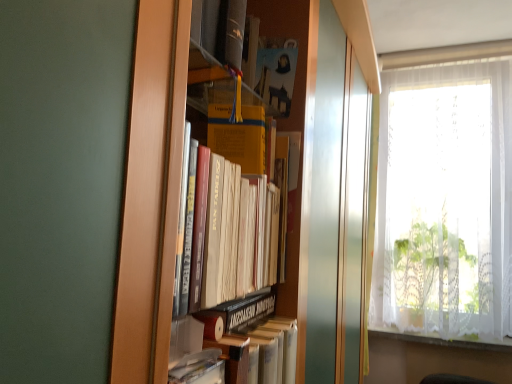
Question: Does hardcover book at center have a larger size compared to white lace curtain at right?

Choices:
 (A) yes
 (B) no

Answer: (B)

Question: Is hardcover book at center to the left of white lace curtain at right from the viewer's perspective?

Choices:
 (A) yes
 (B) no

Answer: (A)

Question: From a real-world perspective, is hardcover book at center located beneath white lace curtain at right?

Choices:
 (A) no
 (B) yes

Answer: (B)

Question: Does hardcover book at center have a lesser height compared to white lace curtain at right?

Choices:
 (A) yes
 (B) no

Answer: (A)

Question: Are hardcover book at center and white lace curtain at right making contact?

Choices:
 (A) no
 (B) yes

Answer: (A)

Question: Is hardcover book at center aimed at white lace curtain at right?

Choices:
 (A) yes
 (B) no

Answer: (B)

Question: Is hardcover book at center at the right side of white lace curtain at lower right?

Choices:
 (A) no
 (B) yes

Answer: (A)

Question: Does hardcover book at center have a greater width compared to white lace curtain at lower right?

Choices:
 (A) no
 (B) yes

Answer: (A)

Question: Is hardcover book at center at the left side of white lace curtain at lower right?

Choices:
 (A) yes
 (B) no

Answer: (A)

Question: From a real-world perspective, is hardcover book at center physically below white lace curtain at lower right?

Choices:
 (A) no
 (B) yes

Answer: (A)

Question: Considering the relative sizes of hardcover book at center and white lace curtain at lower right in the image provided, is hardcover book at center thinner than white lace curtain at lower right?

Choices:
 (A) no
 (B) yes

Answer: (B)

Question: Is hardcover book at center aimed at white lace curtain at lower right?

Choices:
 (A) yes
 (B) no

Answer: (B)

Question: From a real-world perspective, does white lace curtain at lower right sit lower than white lace curtain at right?

Choices:
 (A) yes
 (B) no

Answer: (A)